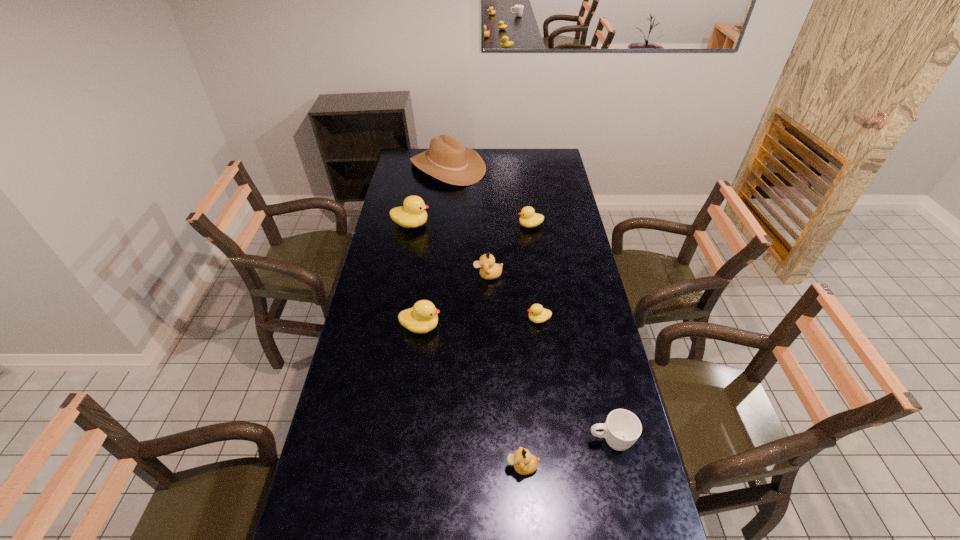
At what (x,y) coordinates should I click in order to perform the action: click on the smallest yellow duckling. Please return your answer as a coordinate pair (x, y). Image resolution: width=960 pixels, height=540 pixels. Looking at the image, I should click on (538, 314).

The height and width of the screenshot is (540, 960). I want to click on the shortest duckling, so click(538, 314).

The width and height of the screenshot is (960, 540). Find the location of `free location located 0.050m on the left of the cowboy hat`. free location located 0.050m on the left of the cowboy hat is located at coordinates (400, 167).

The width and height of the screenshot is (960, 540). In order to click on free spot located 0.210m on the beak of the tallest duckling in this screenshot , I will do `click(476, 225)`.

This screenshot has height=540, width=960. Find the location of `vacant space located 0.360m on the beak of the third smallest yellow duckling`. vacant space located 0.360m on the beak of the third smallest yellow duckling is located at coordinates (540, 327).

The image size is (960, 540). I want to click on vacant space located 0.270m on the face of the farther tan duckling, so click(407, 275).

Identify the location of vacant region located 0.220m on the face of the farther tan duckling. pyautogui.click(x=420, y=275).

You are a GUI agent. You are given a task and a screenshot of the screen. Output one action in this format:
    pyautogui.click(x=<x>, y=<y>)
    Task: Click on the blank space located on the face of the farther tan duckling
    This screenshot has width=960, height=540.
    Given the screenshot: What is the action you would take?
    pyautogui.click(x=459, y=275)

Where is `vacant point located on the beak of the second smallest yellow duckling`? Image resolution: width=960 pixels, height=540 pixels. vacant point located on the beak of the second smallest yellow duckling is located at coordinates (487, 225).

Locate an element on the screen. This screenshot has height=540, width=960. vacant space situated on the beak of the second smallest yellow duckling is located at coordinates click(x=463, y=225).